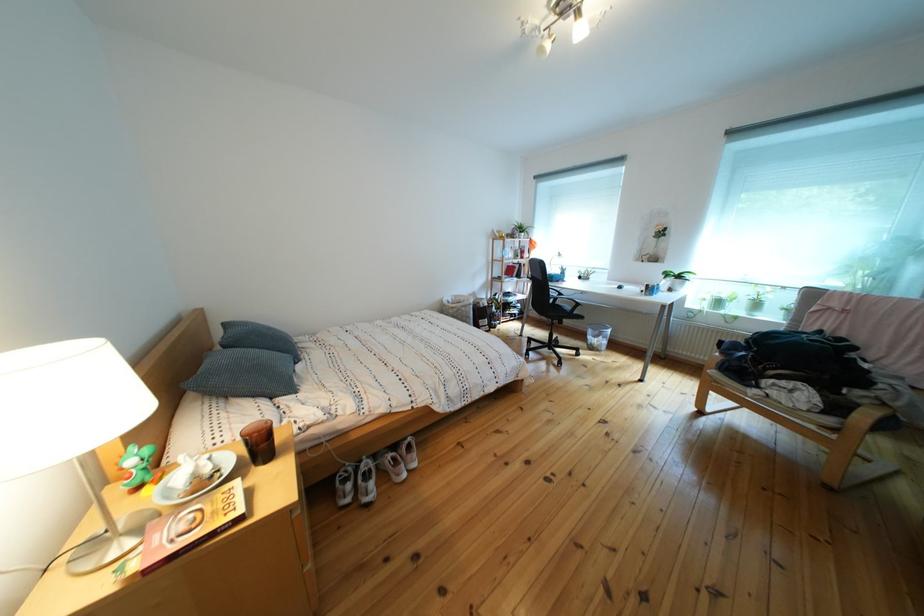
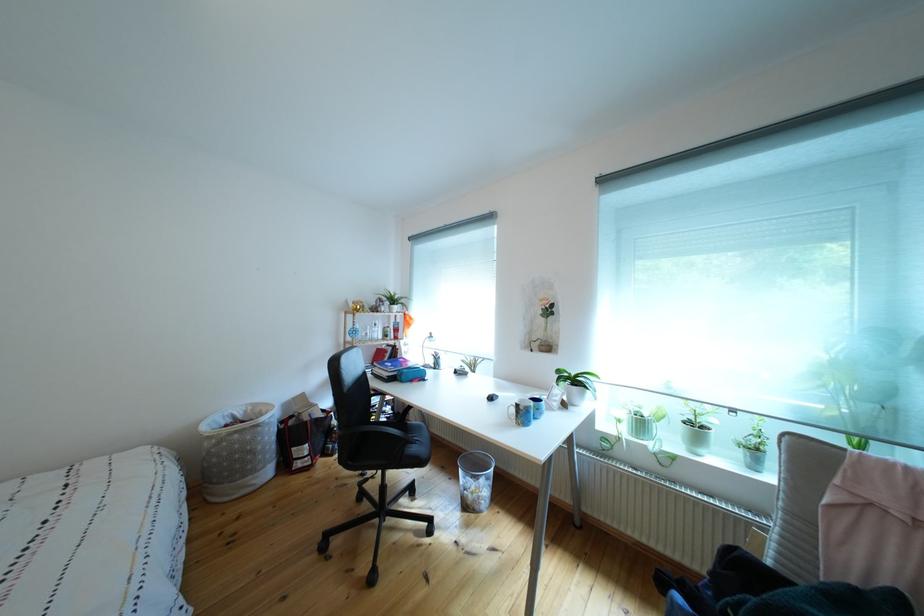
Where in the second image is the point corresponding to (x=661, y=296) from the first image?

(533, 419)